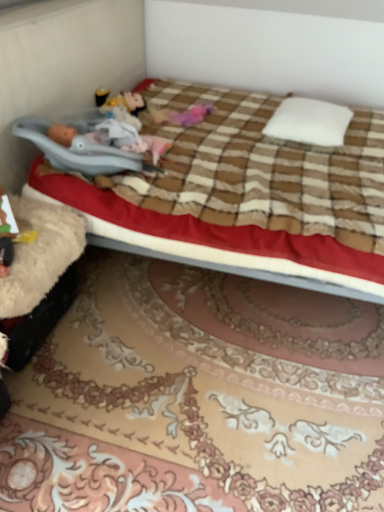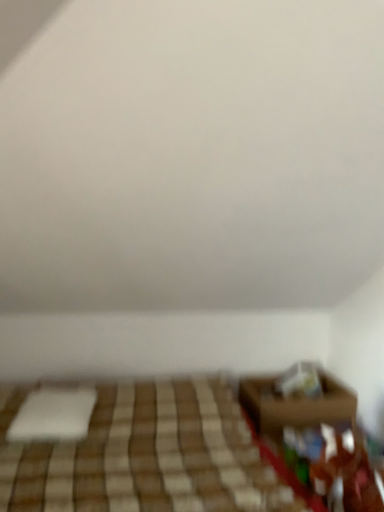
Question: Which way did the camera rotate in the video?

Choices:
 (A) rotated downward
 (B) rotated upward

Answer: (B)